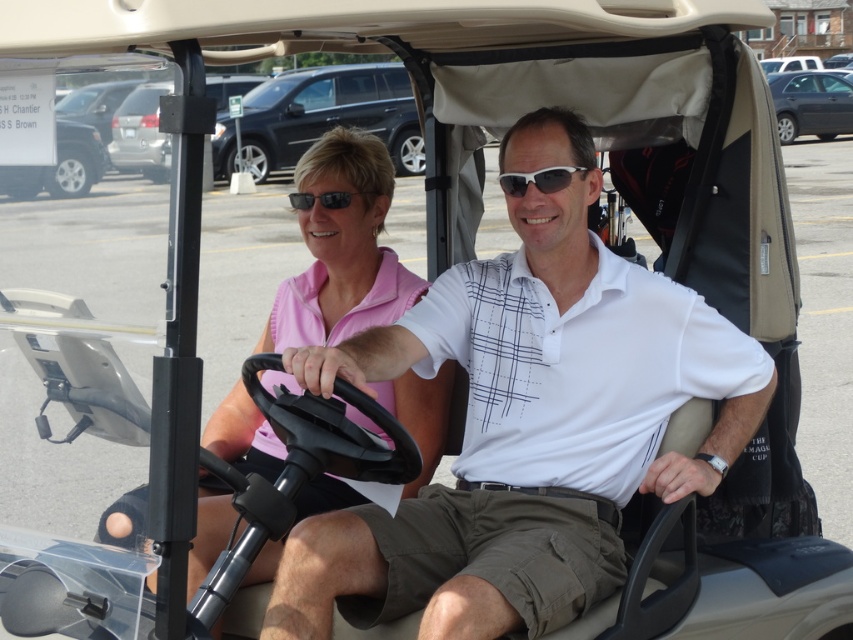
You are a fashion designer observing the two items at the center of the golf cart. Which item is wider, the pink fabric shirt at center or the sunglasses at center?

The pink fabric shirt at center is wider than the sunglasses at center.